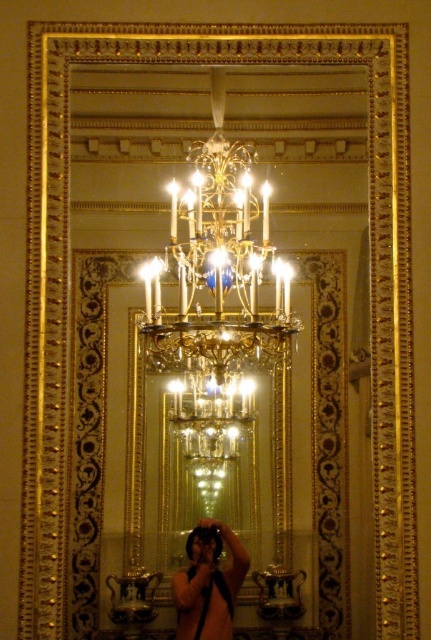
Question: In this image, where is gold/glass chandelier at center located relative to matte black camera at center?

Choices:
 (A) above
 (B) below

Answer: (A)

Question: Does gold/glass chandelier at center have a smaller size compared to matte black camera at center?

Choices:
 (A) no
 (B) yes

Answer: (A)

Question: From the image, what is the correct spatial relationship of gold/glass chandelier at center in relation to matte black camera at center?

Choices:
 (A) left
 (B) right

Answer: (B)